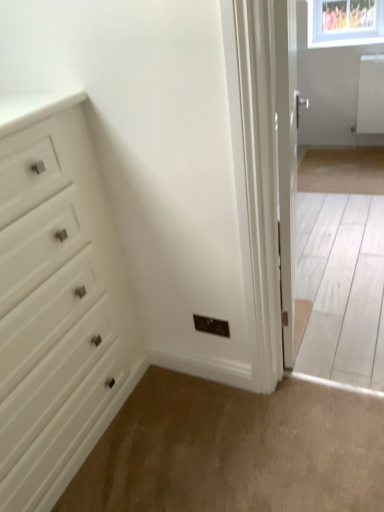
Question: Does white glossy door at right have a smaller size compared to beige carpet at lower center?

Choices:
 (A) yes
 (B) no

Answer: (B)

Question: Is white glossy door at right at the left side of beige carpet at lower center?

Choices:
 (A) yes
 (B) no

Answer: (B)

Question: Are white glossy door at right and beige carpet at lower center far apart?

Choices:
 (A) no
 (B) yes

Answer: (A)

Question: Can you confirm if white glossy door at right is shorter than beige carpet at lower center?

Choices:
 (A) yes
 (B) no

Answer: (B)

Question: Is white glossy door at right taller than beige carpet at lower center?

Choices:
 (A) yes
 (B) no

Answer: (A)

Question: Is white glossy door at right further to camera compared to beige carpet at lower center?

Choices:
 (A) yes
 (B) no

Answer: (A)

Question: Is white glossy door at right turned away from white matte chest of drawers at left?

Choices:
 (A) yes
 (B) no

Answer: (B)

Question: Can you confirm if white glossy door at right is thinner than white matte chest of drawers at left?

Choices:
 (A) no
 (B) yes

Answer: (B)

Question: Considering the relative sizes of white glossy door at right and white matte chest of drawers at left in the image provided, is white glossy door at right bigger than white matte chest of drawers at left?

Choices:
 (A) yes
 (B) no

Answer: (B)

Question: Are white glossy door at right and white matte chest of drawers at left located far from each other?

Choices:
 (A) no
 (B) yes

Answer: (A)

Question: Is white matte chest of drawers at left surrounded by white glossy door at right?

Choices:
 (A) no
 (B) yes

Answer: (A)

Question: Is white glossy door at right at the right side of white matte chest of drawers at left?

Choices:
 (A) no
 (B) yes

Answer: (B)

Question: Is white matte chest of drawers at left shorter than beige carpet at lower center?

Choices:
 (A) yes
 (B) no

Answer: (B)